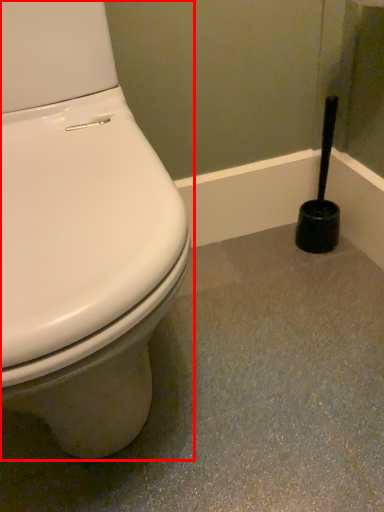
Question: From the image's perspective, what is the correct spatial positioning of toilet (annotated by the red box) in reference to brush?

Choices:
 (A) above
 (B) below

Answer: (B)